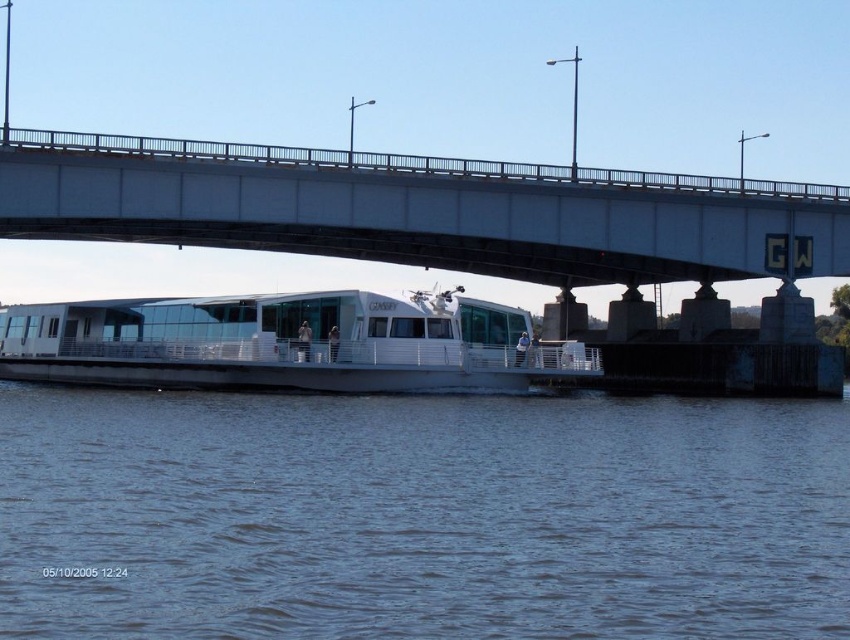
You are a passenger on the ferry and want to know if the blue water at lower center is deeper than the white glossy boat at center. Can you determine this based on the scene?

The blue water at lower center is shorter than the white glossy boat at center, so the water is not deeper than the boat.

You are a photographer planning to capture the ferry passing under the bridge. Based on the scene, which object takes up more space in the image between the blue water at lower center and the white concrete bridge at upper center?

The white concrete bridge at upper center occupies more space in the image than the blue water at lower center.

You are a passenger on the white glossy boat at center and want to know where the blue water at lower center is located relative to your current position. Can you describe its position?

The blue water at lower center is located below the white glossy boat at center, so it is underneath the boat where you are standing.